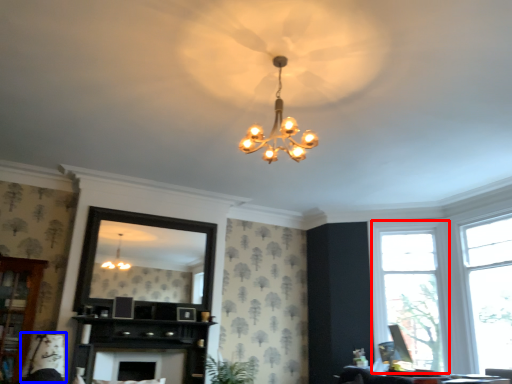
Question: Among these objects, which one is nearest to the camera, window (highlighted by a red box) or swivel chair (highlighted by a blue box)?

Choices:
 (A) window
 (B) swivel chair

Answer: (B)